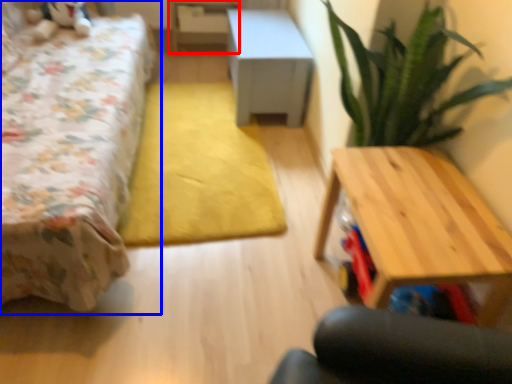
Question: Which point is further to the camera, table (highlighted by a red box) or bed (highlighted by a blue box)?

Choices:
 (A) table
 (B) bed

Answer: (A)